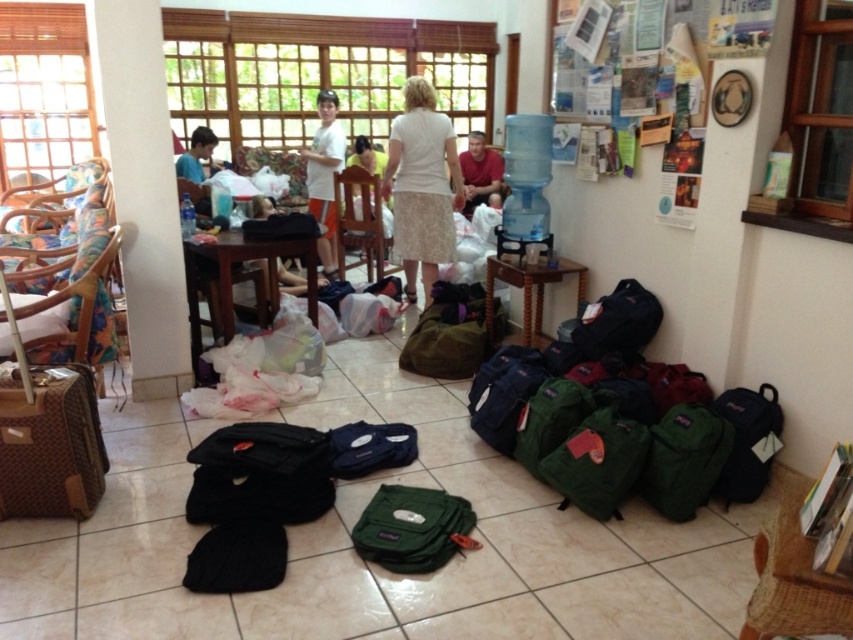
Question: Can you confirm if matte red shirt at center is wider than matte blue shirt at lower left?

Choices:
 (A) yes
 (B) no

Answer: (A)

Question: Does matte red shirt at center come in front of matte blue shirt at lower left?

Choices:
 (A) no
 (B) yes

Answer: (A)

Question: Among these points, which one is nearest to the camera?

Choices:
 (A) (430, 163)
 (B) (28, 369)
 (C) (177, 166)
 (D) (469, 188)

Answer: (B)

Question: Which point is farther to the camera?

Choices:
 (A) (x=410, y=296)
 (B) (x=97, y=481)

Answer: (A)

Question: Is brown textured suitcase at left positioned in front of matte blue shirt at lower left?

Choices:
 (A) no
 (B) yes

Answer: (B)

Question: Which object is the closest to the brown textured suitcase at left?

Choices:
 (A) white matte t-shirt at center
 (B) matte blue shirt at lower left
 (C) white textured skirt at center
 (D) matte red shirt at center

Answer: (C)